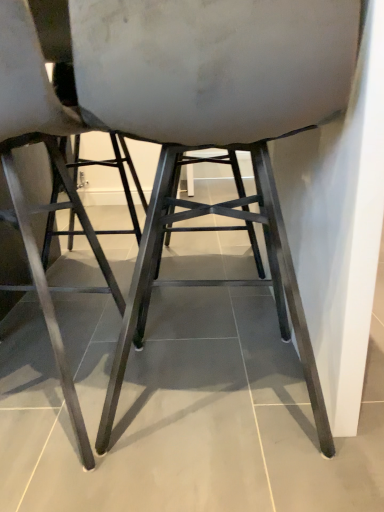
What do you see at coordinates (16, 172) in the screenshot? I see `metallic black stool at left` at bounding box center [16, 172].

At what (x,y) coordinates should I click in order to perform the action: click on metallic black stool at left. Please return your answer as a coordinate pair (x, y). Looking at the image, I should click on (16, 172).

What is the approximate width of metallic black stool at left?

The width of metallic black stool at left is 27.96 centimeters.

Identify the location of metallic black stool at left. This screenshot has height=512, width=384. (16, 172).